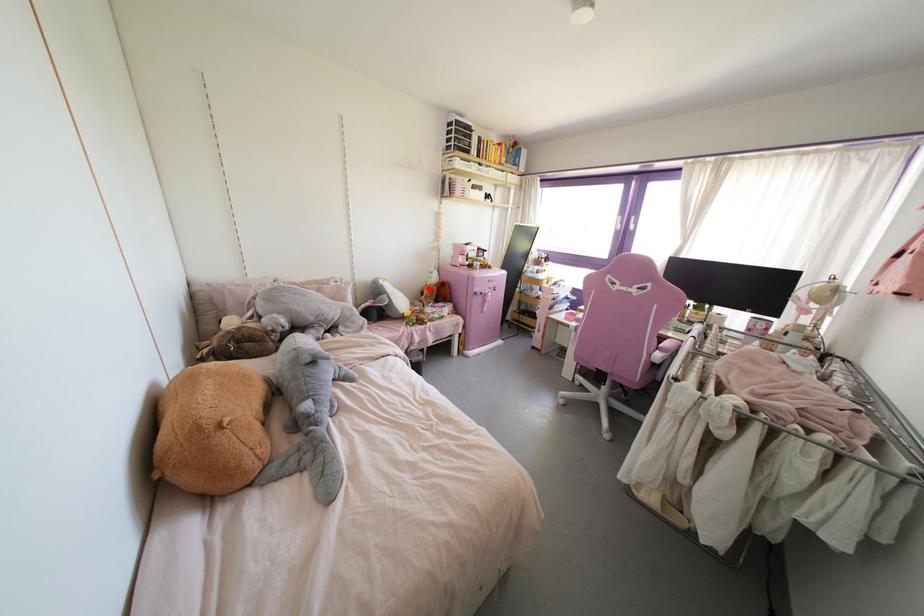
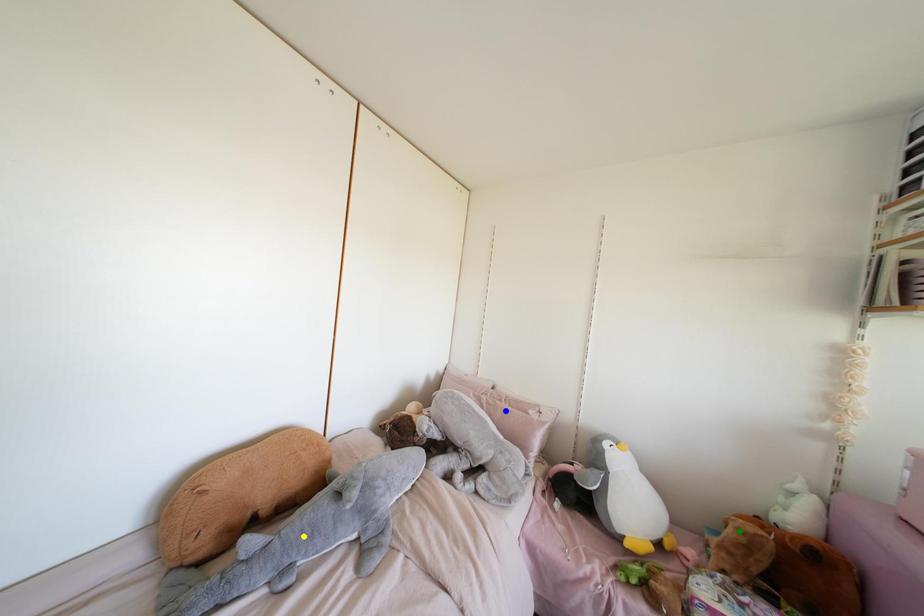
Question: I am providing you with two images of the same scene from different viewpoints. A red point is marked on the first image. You are given multiple points on the second image. In image 2, which mark is for the same physical point as the one in image 1?

Choices:
 (A) blue point
 (B) green point
 (C) yellow point

Answer: (B)